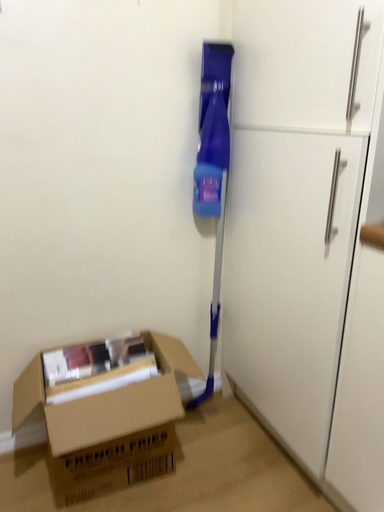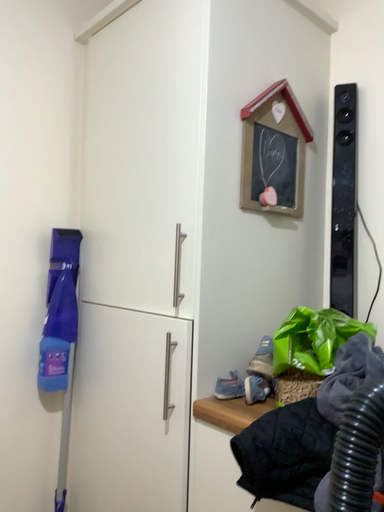
Question: How did the camera likely rotate when shooting the video?

Choices:
 (A) rotated right
 (B) rotated left

Answer: (A)